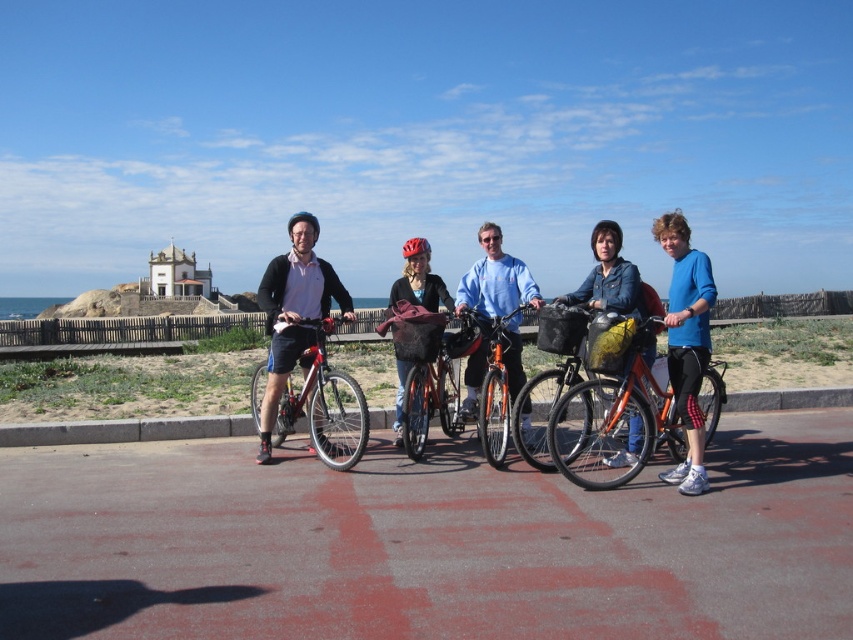
Does shiny metallic bicycle at left appear on the left side of matte yellow helmet at center?

Incorrect, shiny metallic bicycle at left is not on the left side of matte yellow helmet at center.

Does shiny metallic bicycle at left have a larger size compared to matte yellow helmet at center?

No.

This screenshot has width=853, height=640. What are the coordinates of `shiny metallic bicycle at left` in the screenshot? It's located at (323, 404).

How distant is orange metallic bicycle at center from matte yellow helmet at center?

3.39 meters

Is orange metallic bicycle at center smaller than matte yellow helmet at center?

Yes.

Is point (480, 403) closer to camera compared to point (416, 252)?

Yes.

Where is `orange metallic bicycle at center`? orange metallic bicycle at center is located at coordinates (494, 381).

Is point (703, 419) farther from viewer compared to point (500, 444)?

No.

Is point (676, 419) positioned after point (508, 394)?

No, it is in front of (508, 394).

Locate an element on the screen. The width and height of the screenshot is (853, 640). orange matte bicycle at center is located at coordinates (614, 420).